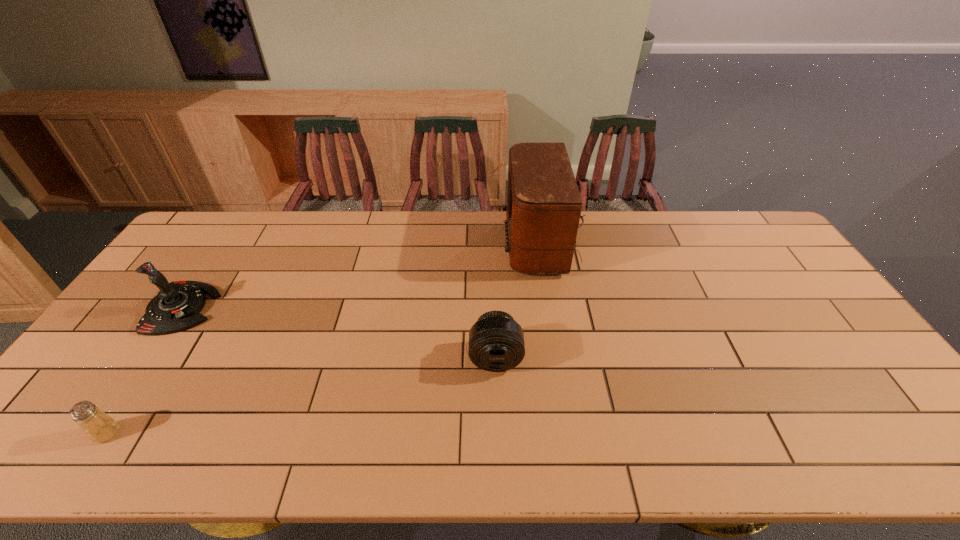
Identify the location of vacant space located 0.400m on the front panel of the tallest object. (387, 243).

Locate an element on the screen. The height and width of the screenshot is (540, 960). free region located on the handle side of the second farthest object is located at coordinates (337, 308).

Image resolution: width=960 pixels, height=540 pixels. In order to click on free space located on the front-facing side of the second nearest object in this screenshot , I will do [x=497, y=412].

Find the location of a particular element. vacant space located 0.090m on the right of the saltshaker is located at coordinates (157, 433).

Identify the location of object that is at the far edge. The height and width of the screenshot is (540, 960). (543, 211).

Find the location of a particular element. The image size is (960, 540). object at the near edge is located at coordinates (100, 427).

You are a GUI agent. You are given a task and a screenshot of the screen. Output one action in this format:
    pyautogui.click(x=<x>, y=<y>)
    Task: Click on the joystick present at the left edge
    
    Given the screenshot: What is the action you would take?
    pyautogui.click(x=176, y=307)

Where is `saltshaker at the left edge`? The width and height of the screenshot is (960, 540). saltshaker at the left edge is located at coordinates (100, 427).

The height and width of the screenshot is (540, 960). I want to click on object located at the near left corner, so click(100, 427).

The image size is (960, 540). In order to click on vacant space at the far edge of the desktop in this screenshot , I will do `click(580, 252)`.